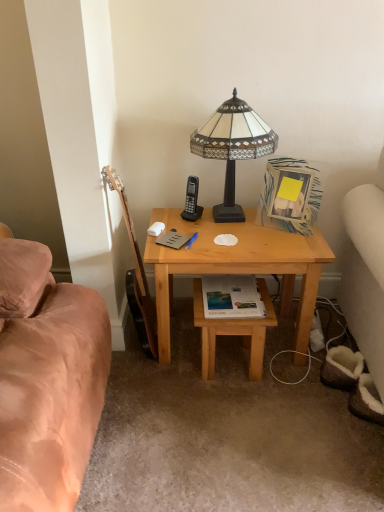
Question: Are matte gray book at center, which is the 2th book from right to left, and brown wood guitar at left far apart?

Choices:
 (A) no
 (B) yes

Answer: (A)

Question: From the image's perspective, is matte gray book at center, marked as the 1th book in a left-to-right arrangement, below brown wood guitar at left?

Choices:
 (A) yes
 (B) no

Answer: (B)

Question: Is matte gray book at center, which is counted as the 2th book, starting from the bottom, in front of brown wood guitar at left?

Choices:
 (A) yes
 (B) no

Answer: (B)

Question: Can you confirm if matte gray book at center, marked as the 1th book in a left-to-right arrangement, is shorter than brown wood guitar at left?

Choices:
 (A) yes
 (B) no

Answer: (A)

Question: Can brown wood guitar at left be found inside matte gray book at center, which ranks as the first book in top-to-bottom order?

Choices:
 (A) no
 (B) yes

Answer: (A)

Question: Is matte gray book at center, which is counted as the 2th book, starting from the bottom, not inside brown wood guitar at left?

Choices:
 (A) yes
 (B) no

Answer: (A)

Question: Considering the relative sizes of stained glass lampshade at upper center and brown wood guitar at left in the image provided, is stained glass lampshade at upper center shorter than brown wood guitar at left?

Choices:
 (A) yes
 (B) no

Answer: (A)

Question: Is stained glass lampshade at upper center closer to camera compared to brown wood guitar at left?

Choices:
 (A) no
 (B) yes

Answer: (A)

Question: Is stained glass lampshade at upper center completely or partially outside of brown wood guitar at left?

Choices:
 (A) yes
 (B) no

Answer: (A)

Question: Is stained glass lampshade at upper center positioned with its back to brown wood guitar at left?

Choices:
 (A) no
 (B) yes

Answer: (A)

Question: Would you say brown wood guitar at left is part of stained glass lampshade at upper center's contents?

Choices:
 (A) no
 (B) yes

Answer: (A)

Question: Is stained glass lampshade at upper center aimed at brown wood guitar at left?

Choices:
 (A) no
 (B) yes

Answer: (A)

Question: Is brown wood guitar at left oriented towards light brown wooden stool at lower center?

Choices:
 (A) yes
 (B) no

Answer: (A)